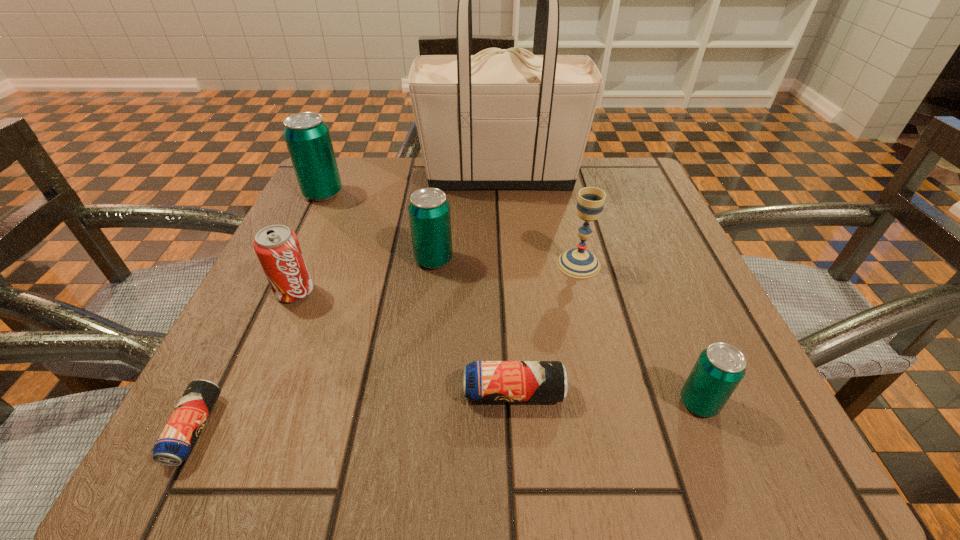
The width and height of the screenshot is (960, 540). Identify the location of the third shortest object. (719, 369).

Locate an element on the screen. This screenshot has width=960, height=540. the fourth beer can from left to right is located at coordinates (484, 381).

Find the location of a particular element. the fourth tallest beer can is located at coordinates (484, 381).

Identify the location of the left blue beer can. The width and height of the screenshot is (960, 540). (178, 438).

Image resolution: width=960 pixels, height=540 pixels. Identify the location of the smaller blue beer can. pos(178,438).

I want to click on vacant region located 0.200m with handles facing forward on the shopping bag, so click(x=333, y=176).

The height and width of the screenshot is (540, 960). What are the coordinates of `blank space located 0.230m with handles facing forward on the shopping bag` in the screenshot? It's located at (320, 176).

Locate an element on the screen. vacant region located with handles facing forward on the shopping bag is located at coordinates (337, 176).

Image resolution: width=960 pixels, height=540 pixels. Identify the location of vacant region located 0.130m on the right of the farthest teal beer can. (403, 193).

Locate an element on the screen. vacant area situated on the front of the gray chalice is located at coordinates (601, 354).